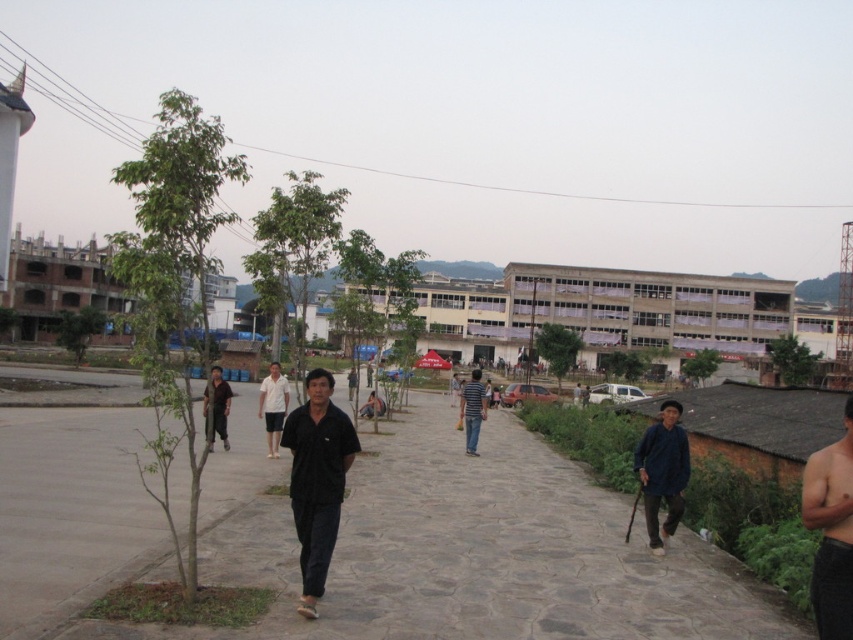
Does point (312, 451) come in front of point (820, 508)?

No, (312, 451) is further to viewer.

Does point (318, 371) come farther from viewer compared to point (814, 464)?

Yes, point (318, 371) is farther from viewer.

Identify the location of black matte shirt at center. The image size is (853, 640). click(x=317, y=480).

Who is more distant from viewer, (848, 506) or (659, 548)?

Point (659, 548)

At what (x,y) coordinates should I click in order to perform the action: click on shiny skin torso at right. Please return your answer as a coordinate pair (x, y). The image size is (853, 640). Looking at the image, I should click on (831, 531).

Does point (837, 548) come behind point (654, 458)?

That is False.

Find the location of a particular element. shiny skin torso at right is located at coordinates (831, 531).

Measure the distance between gray stone pavement at center and black matte shirt at center.

gray stone pavement at center and black matte shirt at center are 3.84 meters apart from each other.

Is gray stone pavement at center thinner than black matte shirt at center?

No, gray stone pavement at center is not thinner than black matte shirt at center.

Between point (245, 518) and point (299, 609), which one is positioned in front?

Positioned in front is point (299, 609).

The height and width of the screenshot is (640, 853). In order to click on gray stone pavement at center in this screenshot , I will do `click(477, 554)`.